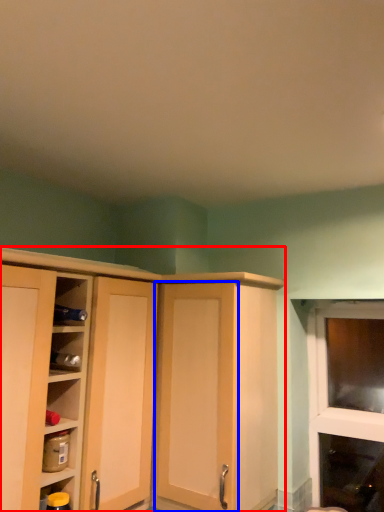
Question: Which object is further to the camera taking this photo, cupboard (highlighted by a red box) or screen door (highlighted by a blue box)?

Choices:
 (A) cupboard
 (B) screen door

Answer: (B)